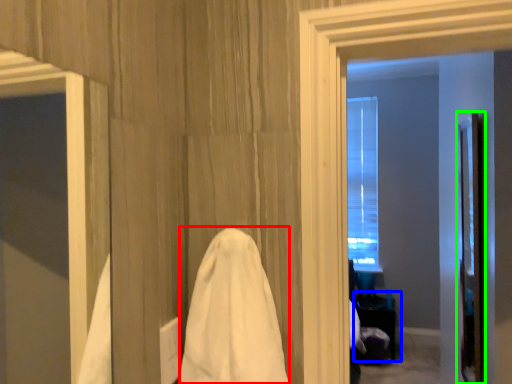
Question: Which object is positioned farthest from bath towel (highlighted by a red box)? Select from table (highlighted by a blue box) and screen door (highlighted by a green box).

Choices:
 (A) table
 (B) screen door

Answer: (A)